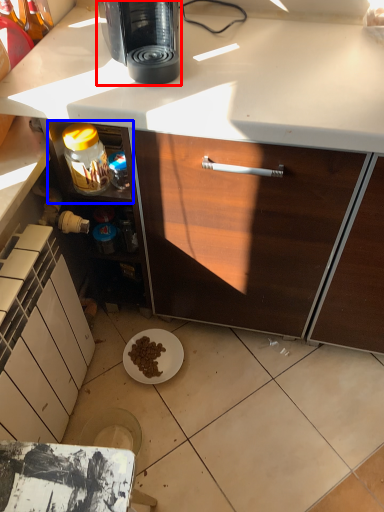
Question: Which object appears farthest to the camera in this image, coffee maker (highlighted by a red box) or shelf (highlighted by a blue box)?

Choices:
 (A) coffee maker
 (B) shelf

Answer: (B)